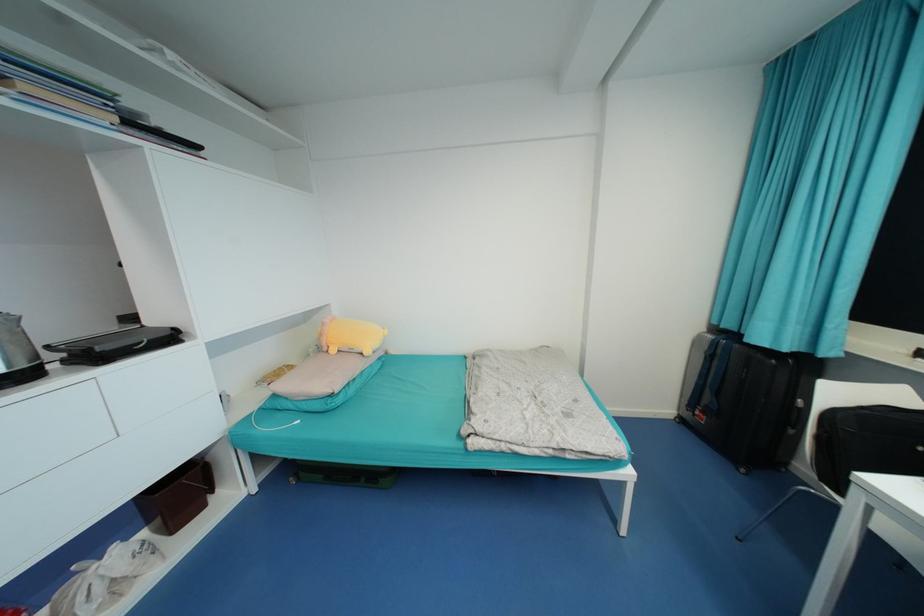
Locate an element on the screen. This screenshot has width=924, height=616. black appliance handle is located at coordinates (116, 344).